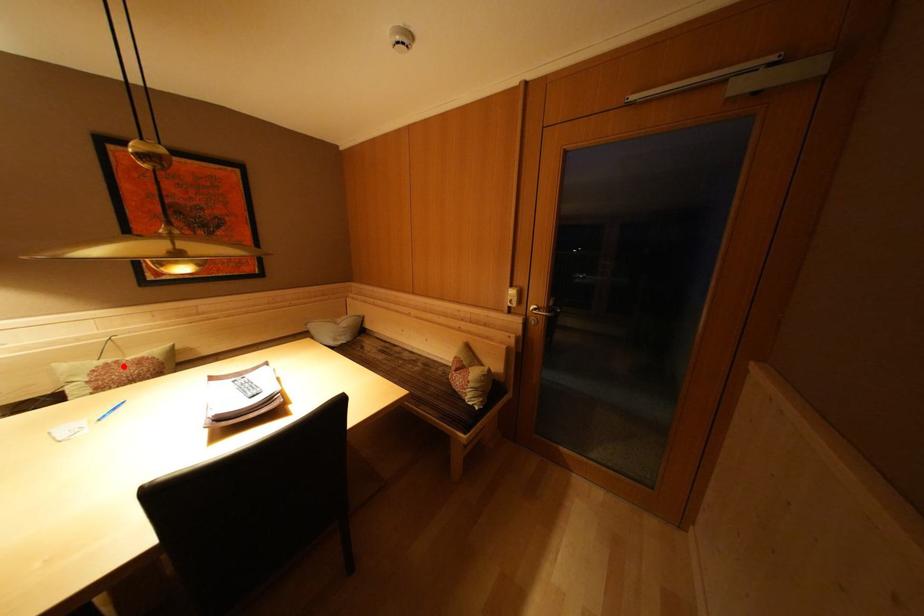
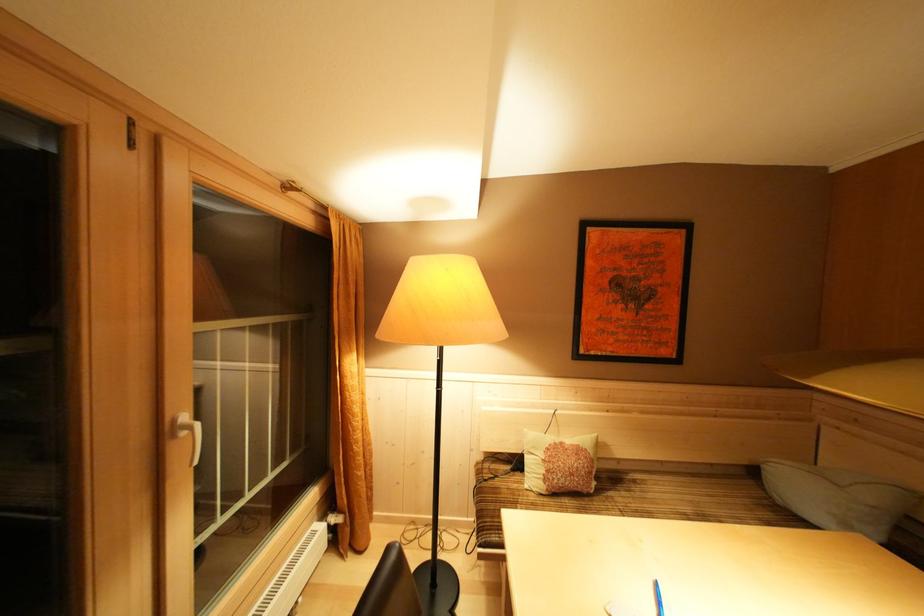
In the second image, find the point that corresponds to the highlighted location in the first image.

(568, 448)